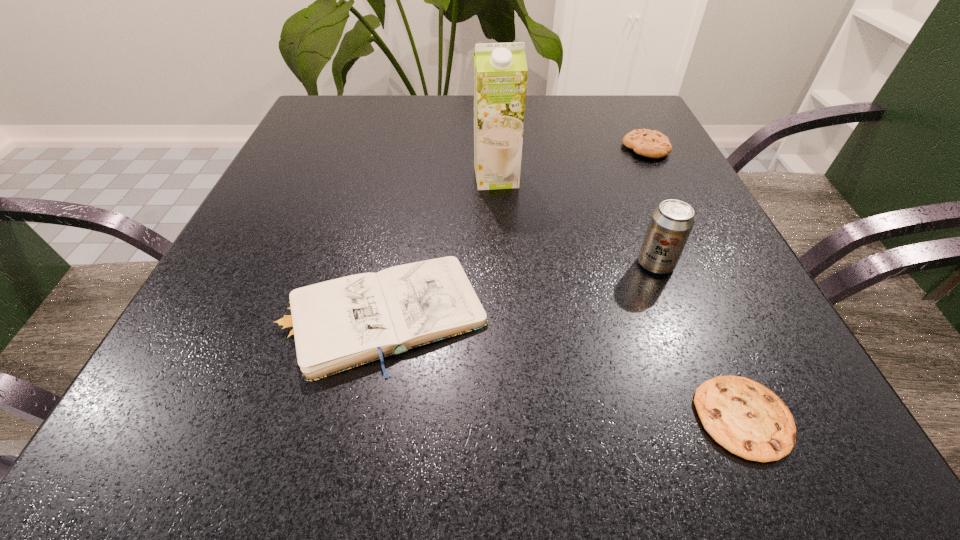
Identify the location of the tallest object. This screenshot has height=540, width=960. (500, 70).

This screenshot has width=960, height=540. Find the location of `the second farthest object`. the second farthest object is located at coordinates (500, 70).

Locate an element on the screen. beer can is located at coordinates (670, 226).

Locate an element on the screen. notebook is located at coordinates (336, 325).

At what (x,y) coordinates should I click in order to perform the action: click on the taller cookie. Please return your answer as a coordinate pair (x, y). Looking at the image, I should click on pos(653,144).

This screenshot has height=540, width=960. In order to click on the farther cookie in this screenshot , I will do `click(653, 144)`.

Where is `the shorter cookie`? This screenshot has height=540, width=960. the shorter cookie is located at coordinates (746, 418).

I want to click on the nearer cookie, so 746,418.

Identify the location of free location located on the back of the tallest object. The image size is (960, 540). (493, 118).

Identify the location of vacant space located on the front of the second tallest object. (704, 384).